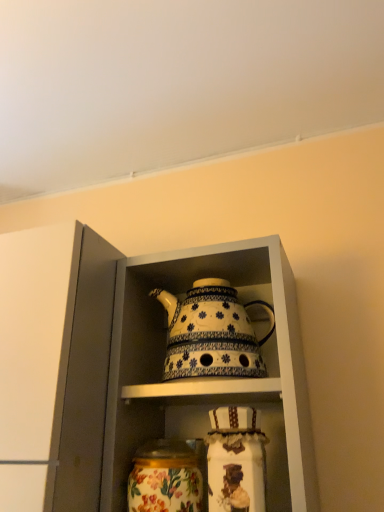
Question: Is floral painted glass jar at lower center at the right side of white ceramic teapot at center?

Choices:
 (A) yes
 (B) no

Answer: (B)

Question: Considering the relative sizes of floral painted glass jar at lower center and white ceramic teapot at center in the image provided, is floral painted glass jar at lower center smaller than white ceramic teapot at center?

Choices:
 (A) no
 (B) yes

Answer: (B)

Question: From the image's perspective, is floral painted glass jar at lower center under white ceramic teapot at center?

Choices:
 (A) no
 (B) yes

Answer: (B)

Question: Considering the relative sizes of floral painted glass jar at lower center and white ceramic teapot at center in the image provided, is floral painted glass jar at lower center taller than white ceramic teapot at center?

Choices:
 (A) no
 (B) yes

Answer: (A)

Question: Is floral painted glass jar at lower center turned away from white ceramic teapot at center?

Choices:
 (A) yes
 (B) no

Answer: (B)

Question: Looking at the image, does white glossy teapot at center seem bigger or smaller compared to white ceramic teapot at center?

Choices:
 (A) small
 (B) big

Answer: (B)

Question: Considering the positions of point (294, 470) and point (226, 286), is point (294, 470) closer or farther from the camera than point (226, 286)?

Choices:
 (A) farther
 (B) closer

Answer: (B)

Question: From a real-world perspective, is white glossy teapot at center above or below white ceramic teapot at center?

Choices:
 (A) above
 (B) below

Answer: (B)

Question: Relative to white ceramic teapot at center, is white glossy teapot at center in front or behind?

Choices:
 (A) front
 (B) behind

Answer: (A)

Question: In terms of size, does floral painted glass jar at lower center appear bigger or smaller than white glossy teapot at center?

Choices:
 (A) small
 (B) big

Answer: (A)

Question: From the image's perspective, is floral painted glass jar at lower center positioned above or below white glossy teapot at center?

Choices:
 (A) below
 (B) above

Answer: (A)

Question: From a real-world perspective, is floral painted glass jar at lower center positioned above or below white glossy teapot at center?

Choices:
 (A) below
 (B) above

Answer: (A)

Question: Considering their positions, is floral painted glass jar at lower center located in front of or behind white glossy teapot at center?

Choices:
 (A) behind
 (B) front

Answer: (A)

Question: Is white glossy teapot at center in front of or behind floral painted glass jar at lower center in the image?

Choices:
 (A) front
 (B) behind

Answer: (A)

Question: Considering the positions of white glossy teapot at center and floral painted glass jar at lower center in the image, is white glossy teapot at center taller or shorter than floral painted glass jar at lower center?

Choices:
 (A) short
 (B) tall

Answer: (B)